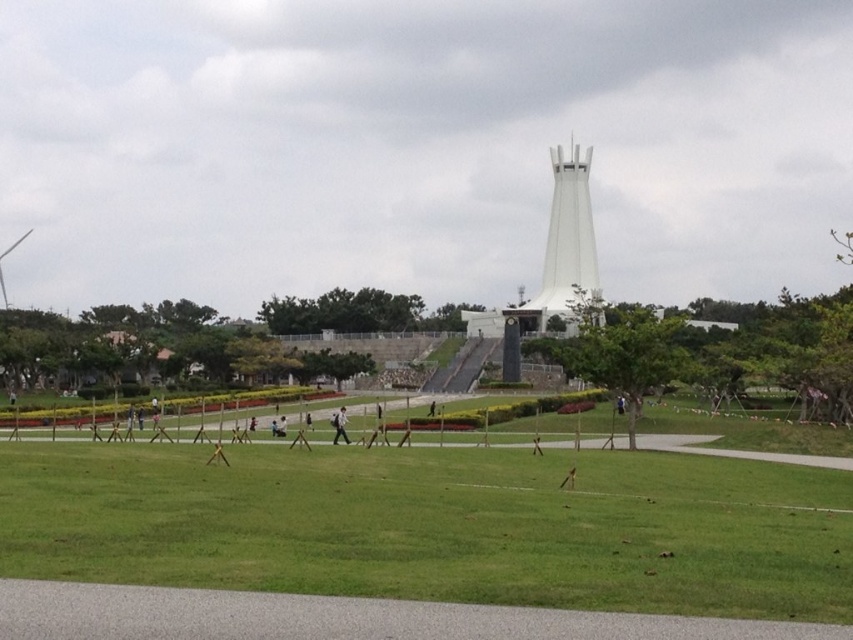
Question: Can you confirm if white glossy tower at center is positioned to the right of white fabric person at center?

Choices:
 (A) no
 (B) yes

Answer: (B)

Question: Which object is closer to the camera taking this photo?

Choices:
 (A) green grass at center
 (B) white fabric person at center

Answer: (A)

Question: Is green grass at center closer to camera compared to white fabric person at center?

Choices:
 (A) no
 (B) yes

Answer: (B)

Question: Which point is farther to the camera?

Choices:
 (A) green grass at center
 (B) white glossy tower at center

Answer: (B)

Question: Which point is closer to the camera?

Choices:
 (A) white glossy tower at center
 (B) green grass at center

Answer: (B)

Question: Does green grass at center appear under white fabric person at center?

Choices:
 (A) yes
 (B) no

Answer: (B)